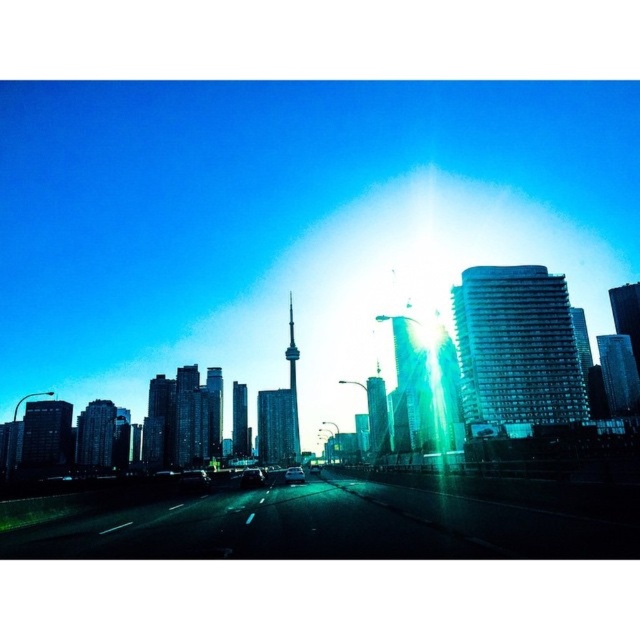
You are driving a metallic silver car at center and want to see the city skyline behind the green glossy highway at center. Can you see the skyline clearly over the highway?

The green glossy highway at center has a lesser height compared to metallic silver car at center, so yes, you can see the skyline clearly over the highway because the car is taller than the highway.

You are driving a shiny black car at center and want to stay in your lane. Based on the scene, which side of the road is the green glossy highway at center located relative to your car?

The green glossy highway at center is positioned on the right side of the shiny black car at center, so it is located to the right of your car.

You are driving a metallic silver car at center and want to switch lanes to the right. The green glossy highway at center has a lane that is wider than your car. Can you safely move into that lane without crossing the white lane lines?

The green glossy highway at center is wider than the metallic silver car at center, so yes, you can safely move into that lane without crossing the white lane lines.